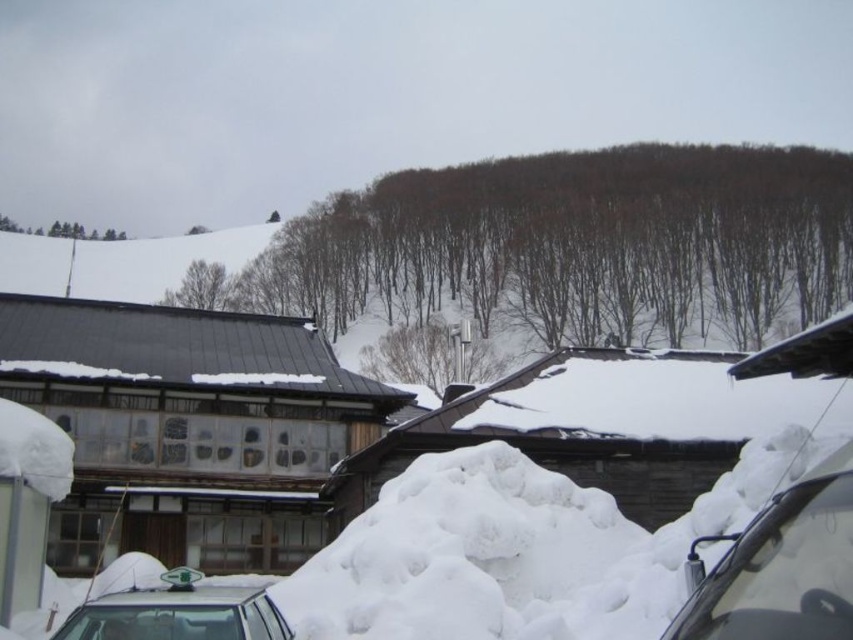
Question: Does brown textured trees at upper center have a larger size compared to white fluffy snow at center?

Choices:
 (A) no
 (B) yes

Answer: (B)

Question: Estimate the real-world distances between objects in this image. Which object is farther from the smooth gray pole at center?

Choices:
 (A) brown textured trees at upper center
 (B) clear glass windshield at lower right
 (C) green leafy tree at upper left

Answer: (C)

Question: Observing the image, what is the correct spatial positioning of clear glass windshield at lower right in reference to green leafy tree at upper left?

Choices:
 (A) below
 (B) above

Answer: (A)

Question: Can you confirm if white fluffy snow at center is bigger than white glossy car at lower left?

Choices:
 (A) no
 (B) yes

Answer: (A)

Question: Which point is farther from the camera taking this photo?

Choices:
 (A) (96, 232)
 (B) (222, 596)
 (C) (380, 360)

Answer: (A)

Question: Which object is closer to the camera taking this photo?

Choices:
 (A) brown textured trees at upper center
 (B) green leafy tree at upper left

Answer: (A)